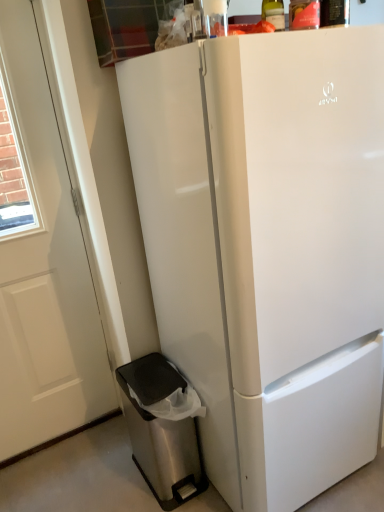
I want to click on free space to the left of stainless steel trash can at lower left, so tap(117, 485).